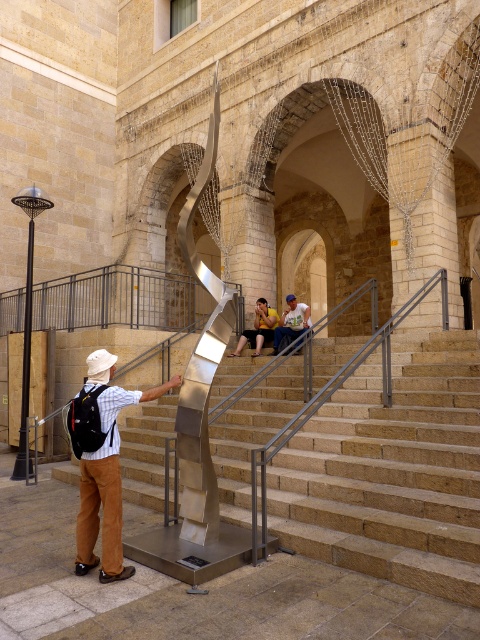
Can you confirm if matte khaki pants at lower left is positioned below white t-shirt at center?

Yes.

Consider the image. Who is positioned more to the left, matte khaki pants at lower left or white t-shirt at center?

From the viewer's perspective, matte khaki pants at lower left appears more on the left side.

Where is `matte khaki pants at lower left`? This screenshot has height=640, width=480. matte khaki pants at lower left is located at coordinates (106, 472).

Is point (113, 515) in front of point (254, 308)?

Yes, point (113, 515) is closer to viewer.

In order to click on matte khaki pants at lower left in this screenshot , I will do `click(106, 472)`.

Measure the distance between smooth stone stairs at center and camera.

smooth stone stairs at center and camera are 3.65 meters apart from each other.

Is point (418, 467) farther from viewer compared to point (256, 317)?

No.

Where is `smooth stone stairs at center`? The width and height of the screenshot is (480, 640). smooth stone stairs at center is located at coordinates (392, 472).